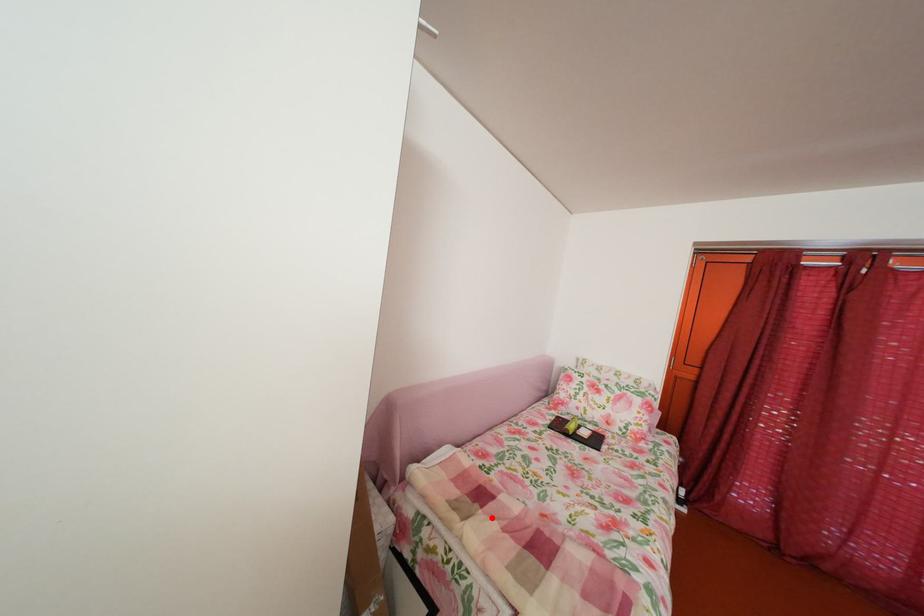
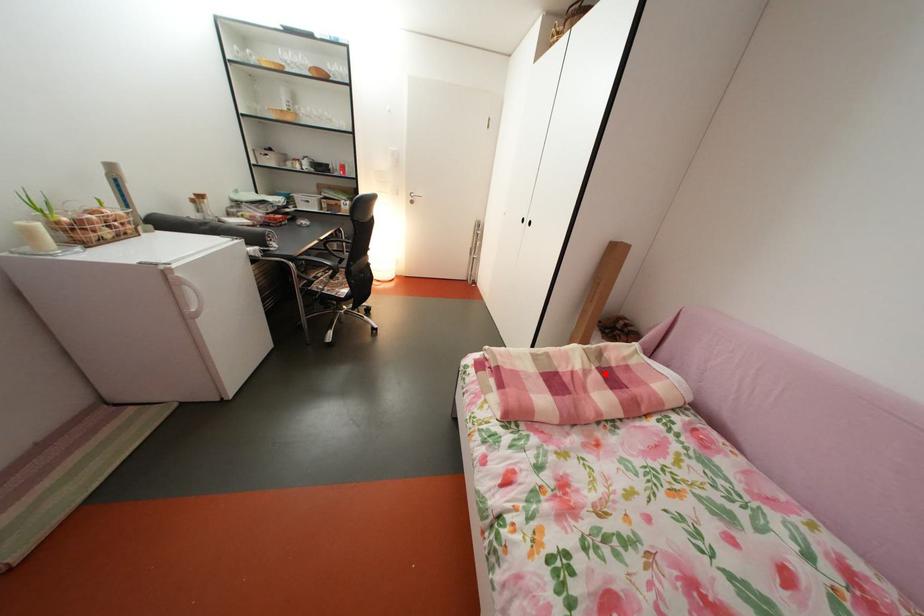
I am providing you with two images of the same scene from different viewpoints. A red point is marked on the first image and another point is marked on the second image. Is the red point in image1 aligned with the point shown in image2?

Yes